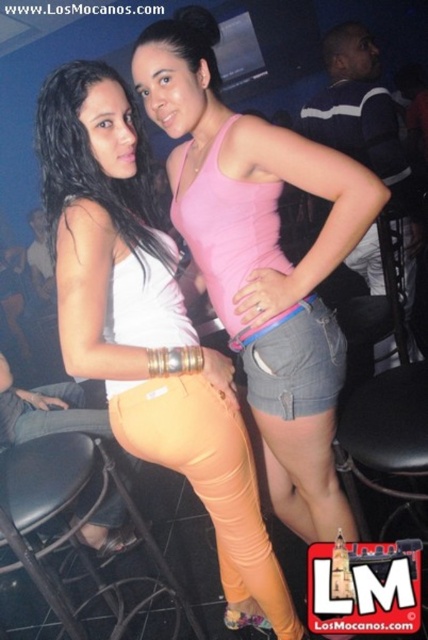
In the scene shown: Does pink matte tank top at center have a larger size compared to black leather bar stool at lower left?

Correct, pink matte tank top at center is larger in size than black leather bar stool at lower left.

This screenshot has width=428, height=640. What do you see at coordinates (262, 260) in the screenshot?
I see `pink matte tank top at center` at bounding box center [262, 260].

The height and width of the screenshot is (640, 428). What do you see at coordinates (262, 260) in the screenshot? I see `pink matte tank top at center` at bounding box center [262, 260].

Where is `pink matte tank top at center`? The width and height of the screenshot is (428, 640). pink matte tank top at center is located at coordinates (262, 260).

Which is more to the left, matte white tank top at center or black leather bar stool at lower left?

Positioned to the left is black leather bar stool at lower left.

Does matte white tank top at center appear on the left side of black leather bar stool at lower left?

No, matte white tank top at center is not to the left of black leather bar stool at lower left.

Who is more forward, (267, 547) or (32, 451)?

Point (267, 547) is in front.

At what (x,y) coordinates should I click in order to perform the action: click on matte white tank top at center. Please return your answer as a coordinate pair (x, y). Image resolution: width=428 pixels, height=640 pixels. Looking at the image, I should click on (148, 328).

Is point (42, 490) positioned in front of point (140, 240)?

That is False.

This screenshot has height=640, width=428. Describe the element at coordinates (61, 512) in the screenshot. I see `black leather bar stool at lower left` at that location.

You are a GUI agent. You are given a task and a screenshot of the screen. Output one action in this format:
    pyautogui.click(x=<x>, y=<y>)
    Task: Click on the black leather bar stool at lower left
    
    Given the screenshot: What is the action you would take?
    pyautogui.click(x=61, y=512)